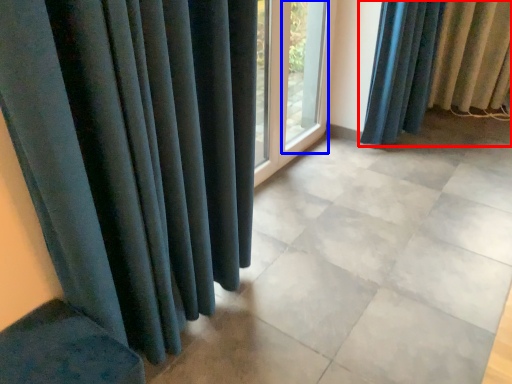
Question: Which of the following is the closest to the observer, curtain (highlighted by a red box) or window frame (highlighted by a blue box)?

Choices:
 (A) curtain
 (B) window frame

Answer: (B)